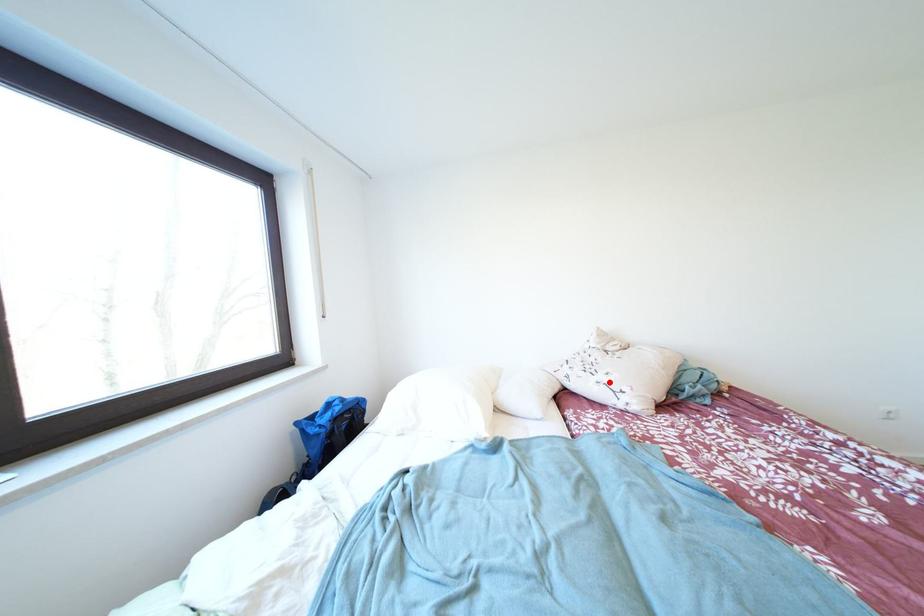
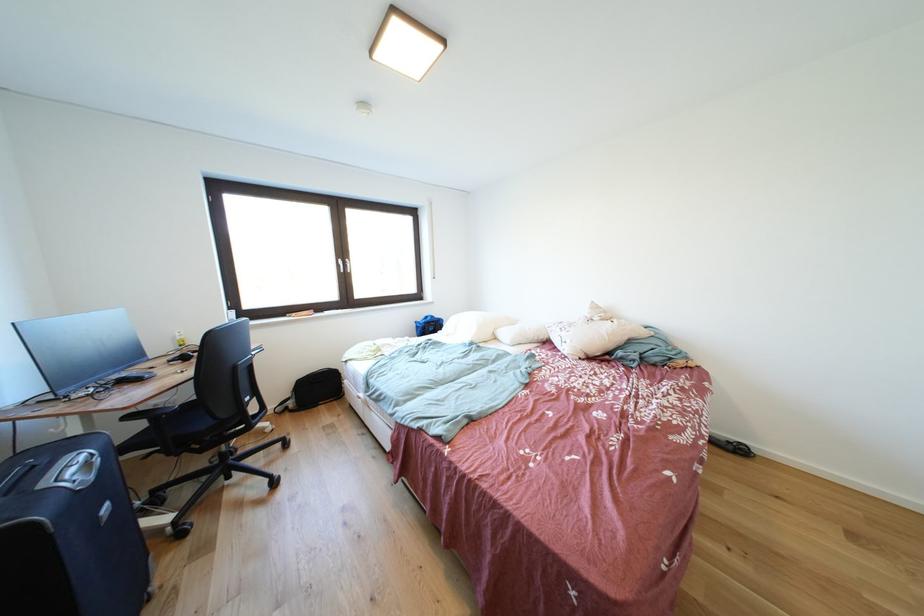
Locate, in the second image, the point that corresponds to the highlighted location in the first image.

(572, 338)